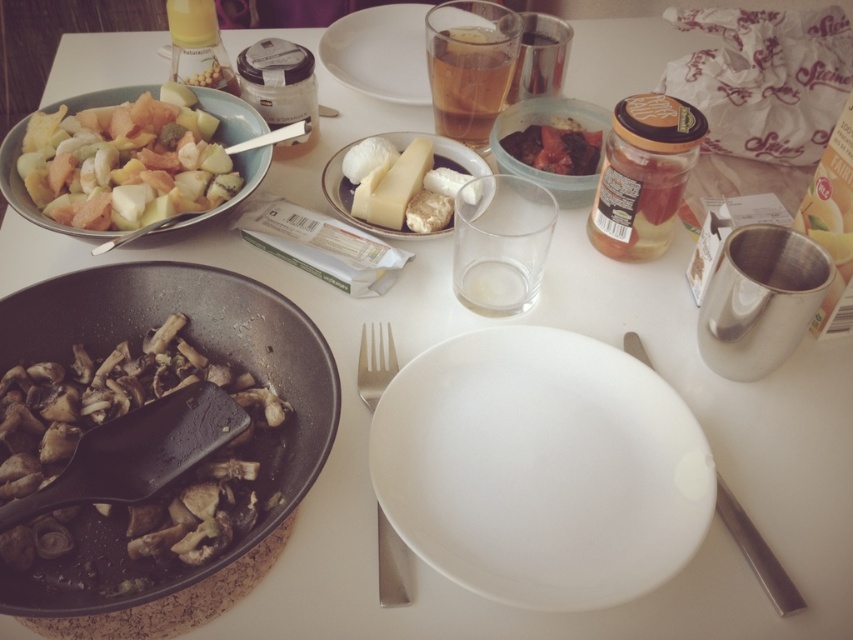
Question: Which of the following is the closest to the observer?

Choices:
 (A) silver metallic fork at lower right
 (B) white matte plate at upper center
 (C) white matte plate at center

Answer: (C)

Question: Among these points, which one is nearest to the camera?

Choices:
 (A) (762, 538)
 (B) (461, 44)
 (C) (421, 65)
 (D) (4, 148)

Answer: (A)

Question: Which is farther from the black plastic frying pan at lower left?

Choices:
 (A) silver metallic fork at lower right
 (B) shiny red jam jar at upper right

Answer: (B)

Question: Is white matte plate at center further to camera compared to white matte plate at upper center?

Choices:
 (A) no
 (B) yes

Answer: (A)

Question: Is black plastic frying pan at lower left smaller than white porcelain plate at center?

Choices:
 (A) no
 (B) yes

Answer: (A)

Question: Is white matte plate at upper center behind silver metallic fork at lower right?

Choices:
 (A) no
 (B) yes

Answer: (B)